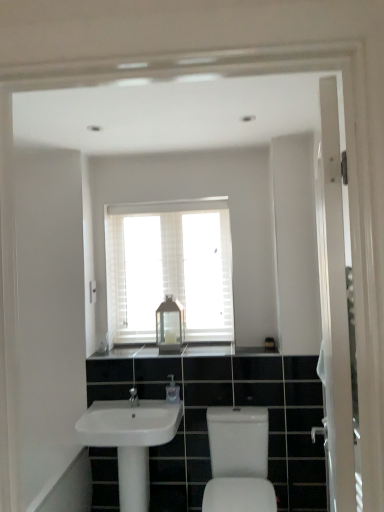
The image size is (384, 512). Identify the location of free space in front of clear plastic soap dispenser at center. [162, 408].